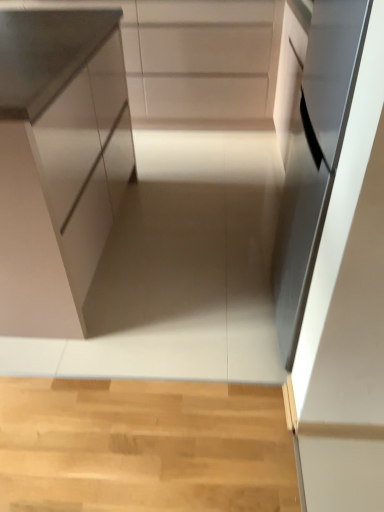
Question: In terms of height, does satin white cabinet at left, which is the 1th cabinetry in bottom-to-top order, look taller or shorter compared to satin black oven at right?

Choices:
 (A) tall
 (B) short

Answer: (B)

Question: Based on their sizes in the image, would you say satin white cabinet at left, the second cabinetry when ordered from back to front, is bigger or smaller than satin black oven at right?

Choices:
 (A) big
 (B) small

Answer: (A)

Question: Considering the real-world distances, which object is closest to the satin black oven at right?

Choices:
 (A) white matte cabinet at upper center, marked as the 1th cabinetry in a back-to-front arrangement
 (B) satin white cabinet at left, the second cabinetry when ordered from top to bottom

Answer: (B)

Question: Based on their relative distances, which object is nearer to the satin white cabinet at left, the first cabinetry positioned from the front?

Choices:
 (A) satin black oven at right
 (B) white matte cabinet at upper center, positioned as the second cabinetry in front-to-back order

Answer: (A)